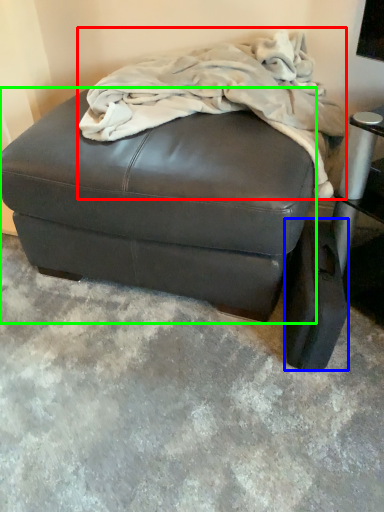
Question: Which object is positioned closest to blanket (highlighted by a red box)? Select from pad (highlighted by a blue box) and furniture (highlighted by a green box).

Choices:
 (A) pad
 (B) furniture

Answer: (B)